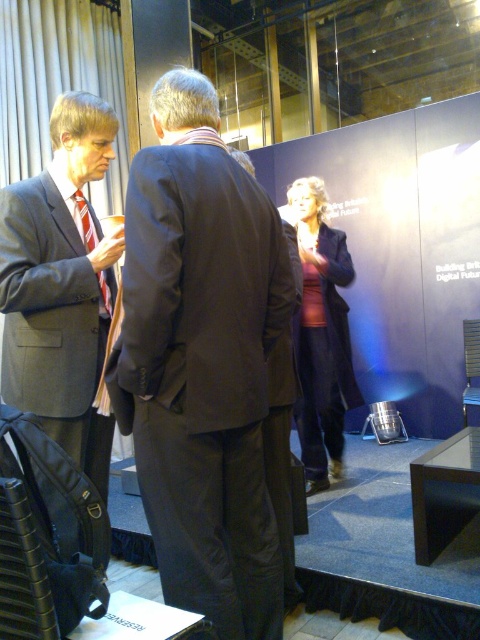
Can you confirm if dark gray suit at center is thinner than matte gray suit at left?

No, dark gray suit at center is not thinner than matte gray suit at left.

Is point (235, 317) farther from viewer compared to point (21, 273)?

No, (235, 317) is closer to viewer.

The height and width of the screenshot is (640, 480). What are the coordinates of `dark gray suit at center` in the screenshot? It's located at (202, 362).

Can you confirm if matte gray suit at left is positioned below red striped tie at left?

Yes.

Where is `matte gray suit at left`? The height and width of the screenshot is (640, 480). matte gray suit at left is located at coordinates (61, 285).

Which is more to the right, dark gray suit at center or red striped tie at left?

dark gray suit at center

Which is more to the left, dark gray suit at center or red striped tie at left?

red striped tie at left

Image resolution: width=480 pixels, height=640 pixels. What are the coordinates of `dark gray suit at center` in the screenshot? It's located at (202, 362).

The image size is (480, 640). Identify the location of dark gray suit at center. (202, 362).